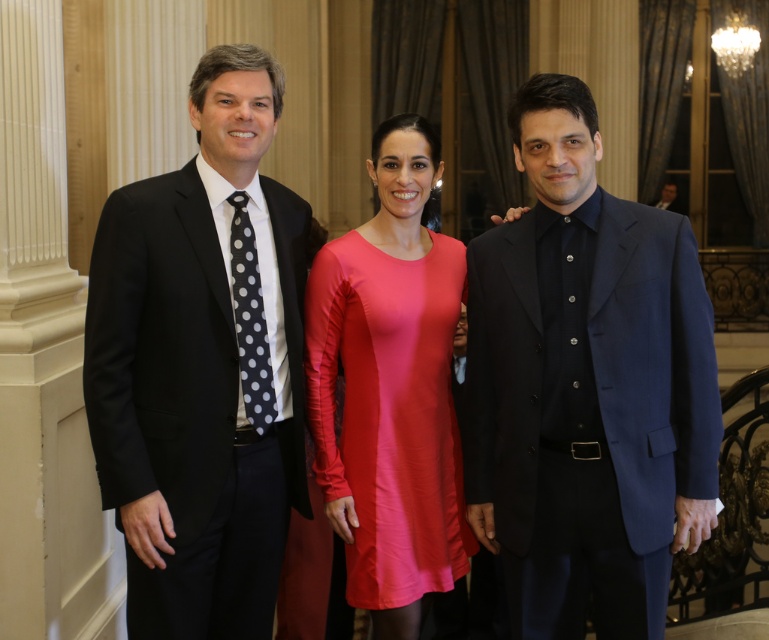
Who is shorter, matte black suit at left or black dotted tie at left?

Standing shorter between the two is black dotted tie at left.

Which is more to the right, matte black suit at left or black dotted tie at left?

black dotted tie at left is more to the right.

Is point (208, 189) behind point (255, 337)?

No.

At what (x,y) coordinates should I click in order to perform the action: click on matte black suit at left. Please return your answer as a coordinate pair (x, y). Looking at the image, I should click on tap(202, 365).

Who is positioned more to the right, matte blue suit at center or matte black suit at left?

matte blue suit at center is more to the right.

Who is higher up, matte blue suit at center or matte black suit at left?

matte black suit at left is above.

Does point (524, 476) come closer to viewer compared to point (102, 230)?

No, (524, 476) is further to viewer.

Find the location of a particular element. The width and height of the screenshot is (769, 640). matte blue suit at center is located at coordinates (586, 387).

Does matte blue suit at center appear under black dotted tie at left?

Yes.

Is point (698, 536) farther from viewer compared to point (258, 321)?

No, it is in front of (258, 321).

This screenshot has width=769, height=640. Find the location of `matte blue suit at center`. matte blue suit at center is located at coordinates (586, 387).